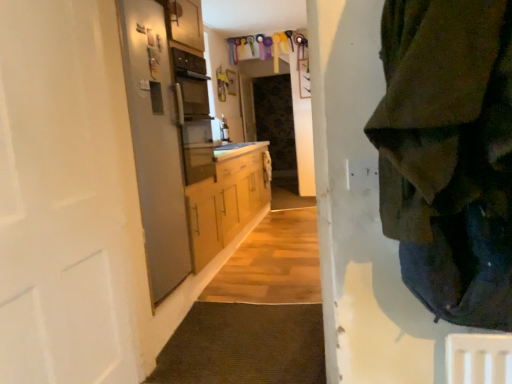
Where is `white matte door at left`? The image size is (512, 384). white matte door at left is located at coordinates (68, 200).

Considering the points (135, 18) and (51, 222), which point is in front, point (135, 18) or point (51, 222)?

Point (51, 222)

How many degrees apart are the facing directions of satin silver refrigerator at left and white matte door at left?

0.00475 degrees separate the facing orientations of satin silver refrigerator at left and white matte door at left.

Does satin silver refrigerator at left come behind white matte door at left?

Yes, it is behind white matte door at left.

Is satin silver refrigerator at left at the left side of white matte door at left?

Incorrect, satin silver refrigerator at left is not on the left side of white matte door at left.

Can you confirm if satin silver refrigerator at left is wider than dark green fabric at right?

No.

Is satin silver refrigerator at left in front of or behind dark green fabric at right in the image?

Visually, satin silver refrigerator at left is located behind dark green fabric at right.

Which of these two, satin silver refrigerator at left or dark green fabric at right, is smaller?

With smaller size is satin silver refrigerator at left.

From a real-world perspective, which is physically above, satin silver refrigerator at left or dark green fabric at right?

dark green fabric at right is physically above.

Is dark green fabric at right behind satin silver refrigerator at left?

No, the depth of dark green fabric at right is less than that of satin silver refrigerator at left.

Does dark green fabric at right appear on the right side of satin silver refrigerator at left?

Yes, dark green fabric at right is to the right of satin silver refrigerator at left.

The width and height of the screenshot is (512, 384). Identify the location of screen door on the left of dark green fabric at right. (155, 143).

Can you confirm if dark green fabric at right is shorter than satin silver refrigerator at left?

Indeed, dark green fabric at right has a lesser height compared to satin silver refrigerator at left.

Considering the relative positions of white matte door at left and dark green fabric at right in the image provided, is white matte door at left in front of dark green fabric at right?

No, white matte door at left is behind dark green fabric at right.

How distant is white matte door at left from dark green fabric at right?

white matte door at left and dark green fabric at right are 1.28 meters apart from each other.

This screenshot has height=384, width=512. I want to click on clothing that appears above the white matte door at left (from the image's perspective), so click(x=449, y=154).

From a real-world perspective, is white matte door at left positioned over dark green fabric at right based on gravity?

Actually, white matte door at left is physically below dark green fabric at right in the real world.

Does dark green fabric at right have a larger size compared to white matte door at left?

Incorrect, dark green fabric at right is not larger than white matte door at left.

Considering the positions of point (509, 144) and point (99, 53), is point (509, 144) closer or farther from the camera than point (99, 53)?

Point (509, 144) is closer to the camera than point (99, 53).

From the picture: Based on their positions, is dark green fabric at right located to the left or right of white matte door at left?

dark green fabric at right is to the right of white matte door at left.

Relative to white matte door at left, is dark green fabric at right in front or behind?

Visually, dark green fabric at right is located in front of white matte door at left.

Considering the relative sizes of white matte door at left and satin silver refrigerator at left in the image provided, is white matte door at left taller than satin silver refrigerator at left?

In fact, white matte door at left may be shorter than satin silver refrigerator at left.

Is white matte door at left not near satin silver refrigerator at left?

No, there isn't a large distance between white matte door at left and satin silver refrigerator at left.

From the image's perspective, is white matte door at left over satin silver refrigerator at left?

No.

In the scene shown: Is white matte door at left in front of or behind satin silver refrigerator at left in the image?

Visually, white matte door at left is located in front of satin silver refrigerator at left.

This screenshot has height=384, width=512. In order to click on screen door on the right of white matte door at left in this screenshot , I will do `click(155, 143)`.

Locate an element on the screen. clothing located in front of the satin silver refrigerator at left is located at coordinates (449, 154).

Based on their spatial positions, is white matte door at left or satin silver refrigerator at left closer to dark green fabric at right?

white matte door at left is positioned closer to the anchor dark green fabric at right.

From the image, which object appears to be farther from dark green fabric at right, satin silver refrigerator at left or white matte door at left?

Among the two, satin silver refrigerator at left is located further to dark green fabric at right.

When comparing their distances from satin silver refrigerator at left, does white matte door at left or dark green fabric at right seem closer?

Among the two, white matte door at left is located nearer to satin silver refrigerator at left.

Which object lies further to the anchor point white matte door at left, dark green fabric at right or satin silver refrigerator at left?

The object further to white matte door at left is dark green fabric at right.

From the image, which object appears to be farther from satin silver refrigerator at left, dark green fabric at right or white matte door at left?

dark green fabric at right is positioned further to the anchor satin silver refrigerator at left.

Based on their spatial positions, is satin silver refrigerator at left or dark green fabric at right further from white matte door at left?

The object further to white matte door at left is dark green fabric at right.

Identify the location of door positioned between dark green fabric at right and satin silver refrigerator at left from near to far. (68, 200).